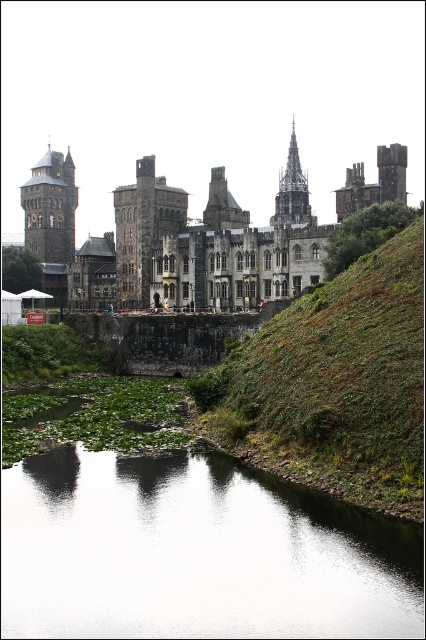
You are standing on the riverbank looking at the scene. Which object, the transparent water at center or the stone castle at center, is nearer to you?

The transparent water at center is closer to the viewer than the stone castle at center.

Consider the image. You are a guest approaching the stone castle at center and the gray stone spire at upper center. Which structure would you see first as you approach the castle from the riverbank?

The gray stone spire at upper center would be seen first because it is positioned higher up, above the stone castle at center, making it visible from a greater distance.